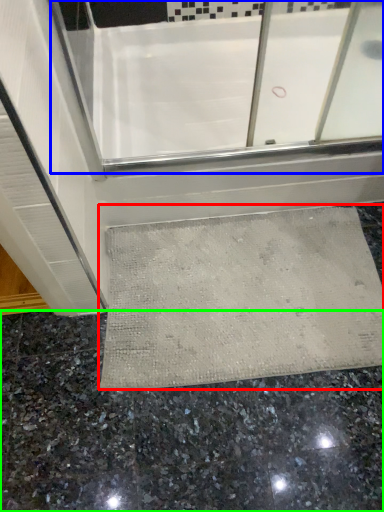
Question: Based on their relative distances, which object is farther from bath mat (highlighted by a red box)? Choose from bath (highlighted by a blue box) and granite (highlighted by a green box).

Choices:
 (A) bath
 (B) granite

Answer: (A)